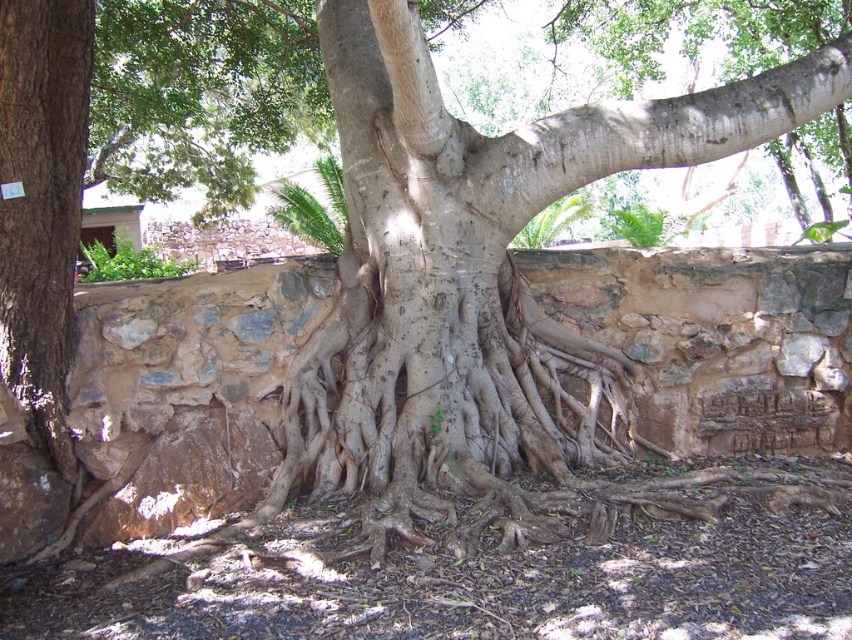
Question: Which of the following is the closest to the observer?

Choices:
 (A) (1, 4)
 (B) (364, 376)

Answer: (A)

Question: Which point is closer to the camera taking this photo?

Choices:
 (A) (45, 381)
 (B) (412, 499)

Answer: (B)

Question: Among these objects, which one is farthest from the camera?

Choices:
 (A) smooth gray bark at center
 (B) brown rough bark at left

Answer: (A)

Question: Can you confirm if smooth gray bark at center is positioned to the left of brown rough bark at left?

Choices:
 (A) yes
 (B) no

Answer: (B)

Question: Does smooth gray bark at center have a greater width compared to brown rough bark at left?

Choices:
 (A) no
 (B) yes

Answer: (B)

Question: Can you confirm if smooth gray bark at center is positioned to the left of brown rough bark at left?

Choices:
 (A) no
 (B) yes

Answer: (A)